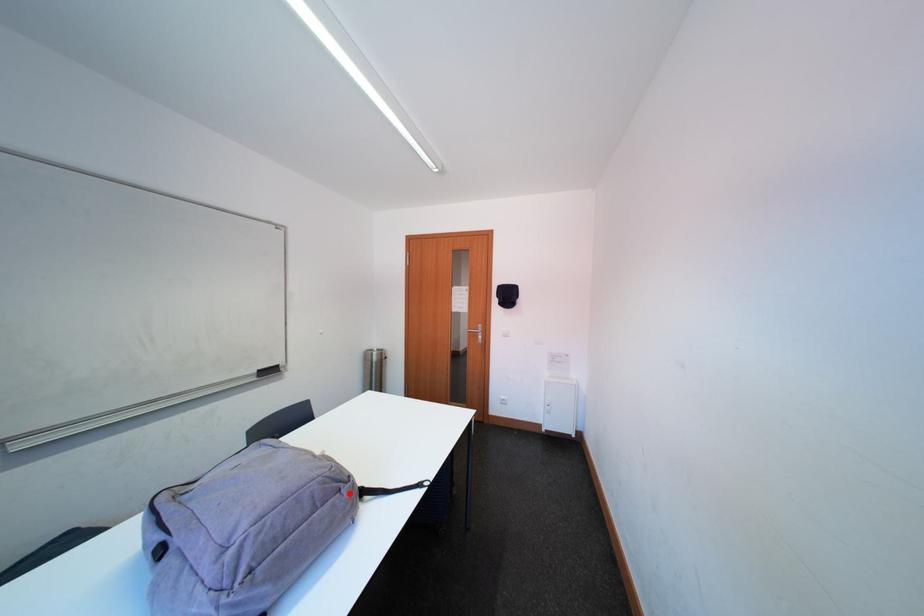
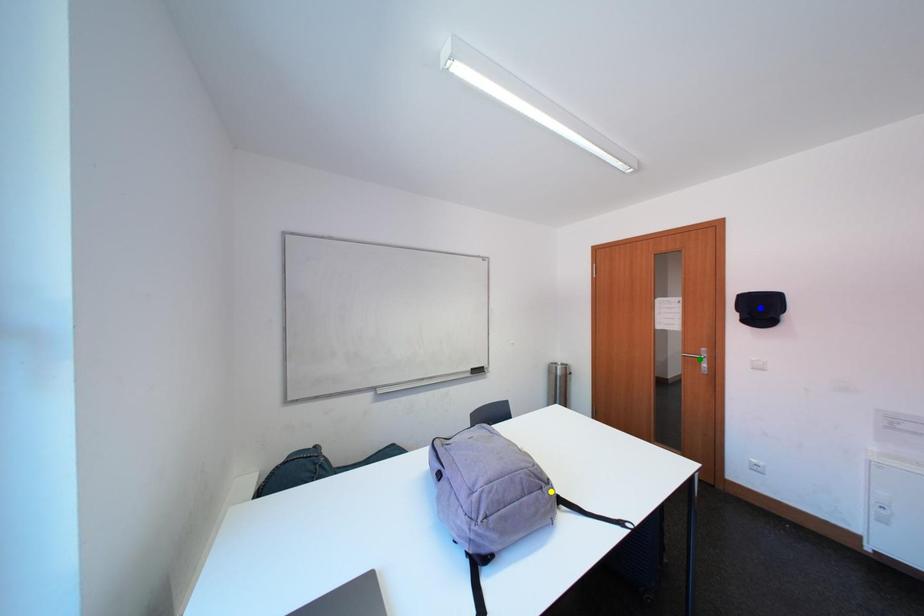
Question: I am providing you with two images of the same scene from different viewpoints. A red point is marked on the first image. You are given multiple points on the second image. Can you choose the point in image 2 that corresponds to the point in image 1?

Choices:
 (A) green point
 (B) yellow point
 (C) blue point

Answer: (B)